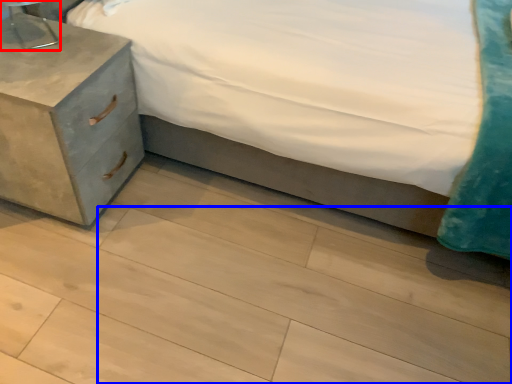
Question: Which object is closer to the camera taking this photo, table lamp (highlighted by a red box) or tile (highlighted by a blue box)?

Choices:
 (A) table lamp
 (B) tile

Answer: (B)